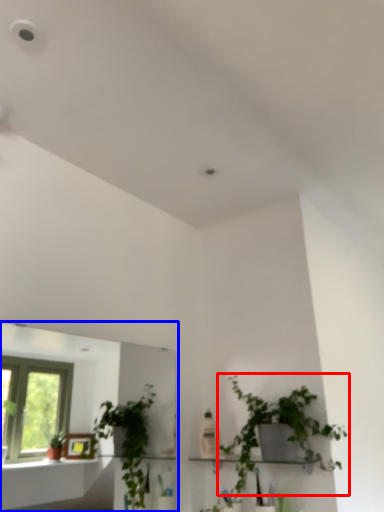
Question: Which object is closer to the camera taking this photo, houseplant (highlighted by a red box) or mirror (highlighted by a blue box)?

Choices:
 (A) houseplant
 (B) mirror

Answer: (B)